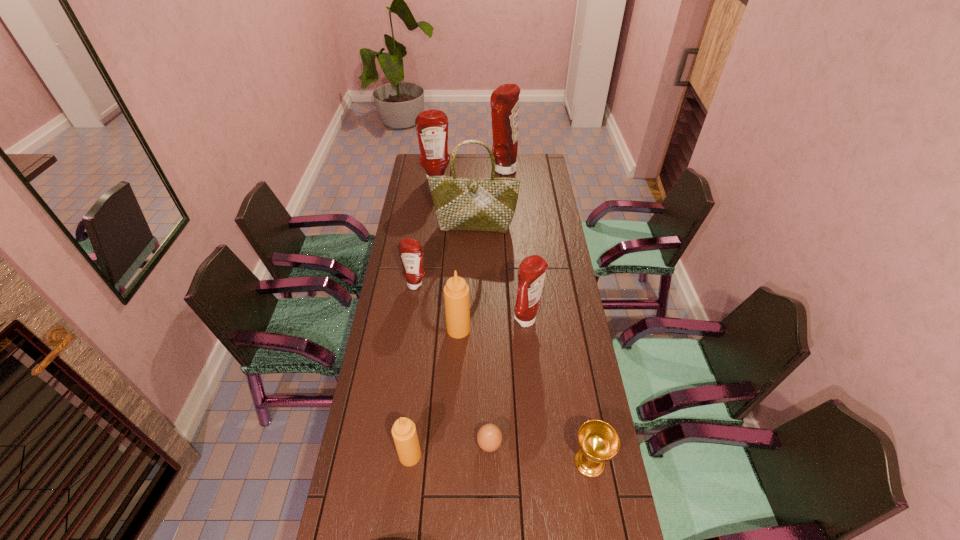
The height and width of the screenshot is (540, 960). In order to click on the smaller tan condiment in this screenshot , I will do `click(404, 433)`.

At what (x,y) coordinates should I click in order to perform the action: click on the nearest condiment. Please return your answer as a coordinate pair (x, y). Image resolution: width=960 pixels, height=540 pixels. Looking at the image, I should click on (404, 433).

Identify the location of the second shortest object. (598, 441).

The image size is (960, 540). Find the location of `the rightmost object`. the rightmost object is located at coordinates (598, 441).

Where is `boiled egg`? The height and width of the screenshot is (540, 960). boiled egg is located at coordinates (489, 437).

Find the location of a particular element. This screenshot has width=960, height=540. the shortest object is located at coordinates (489, 437).

Locate an element on the screen. vacant point located on the front of the biggest red condiment is located at coordinates (505, 206).

Find the location of a particular element. Image resolution: width=960 pixels, height=540 pixels. blank area located 0.120m on the left of the shopping bag is located at coordinates (406, 227).

Find the location of a particular element. free space located 0.100m on the right of the second biggest red condiment is located at coordinates (470, 180).

Where is `vacant region located 0.390m on the right of the fourth condiment from left to right`? vacant region located 0.390m on the right of the fourth condiment from left to right is located at coordinates (576, 329).